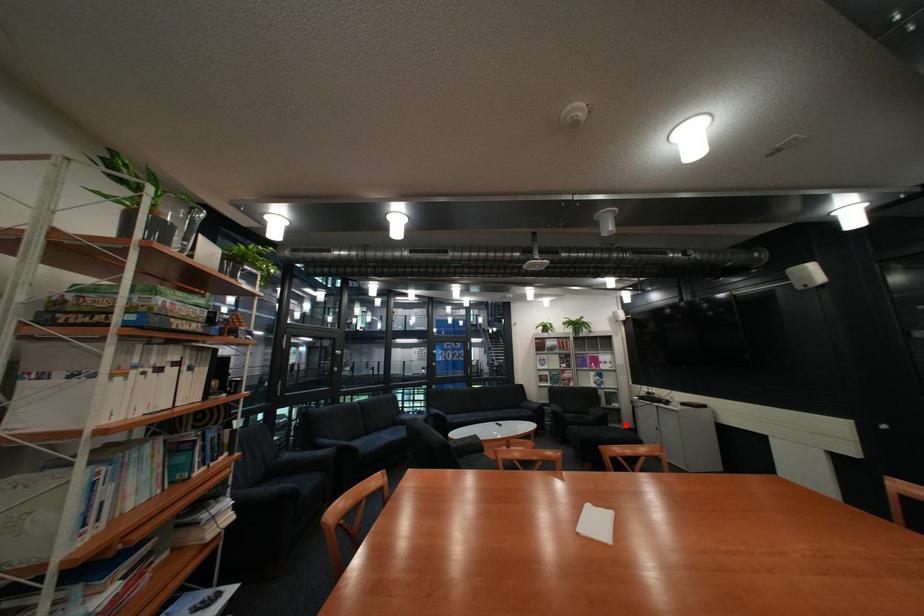
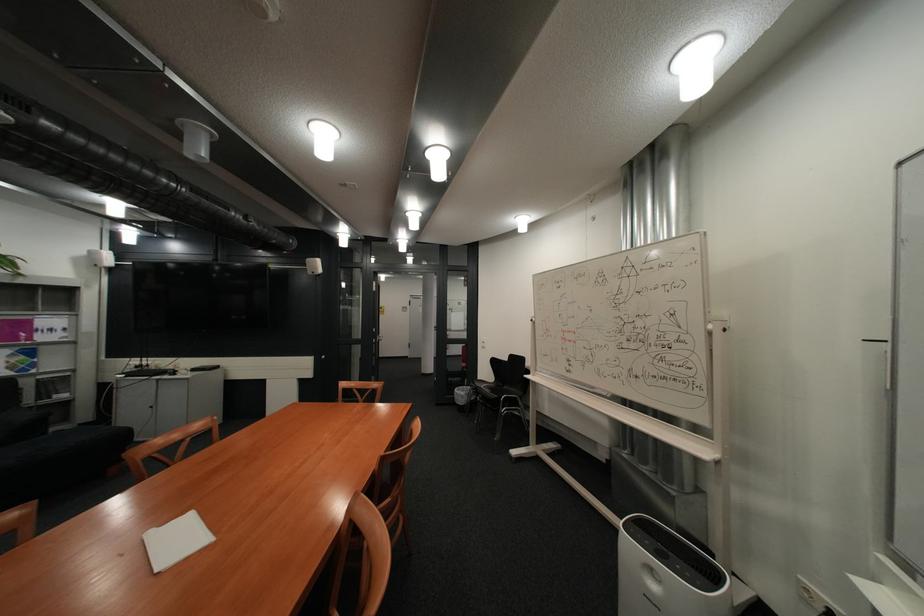
Question: I am providing you with two images of the same scene from different viewpoints. A red point is shown in image1. For the corresponding object point in image2, is it positioned nearer or farther from the camera?

Choices:
 (A) Nearer
 (B) Farther

Answer: (A)